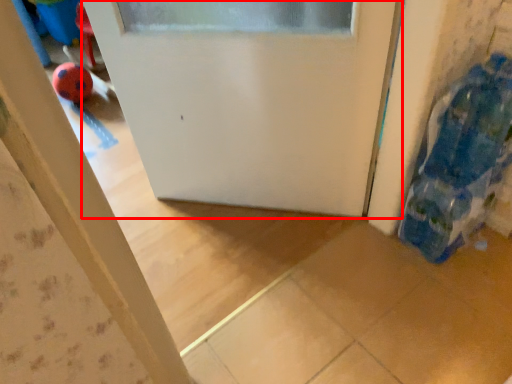
Question: Where is door (annotated by the red box) located in relation to toy in the image?

Choices:
 (A) right
 (B) left

Answer: (B)